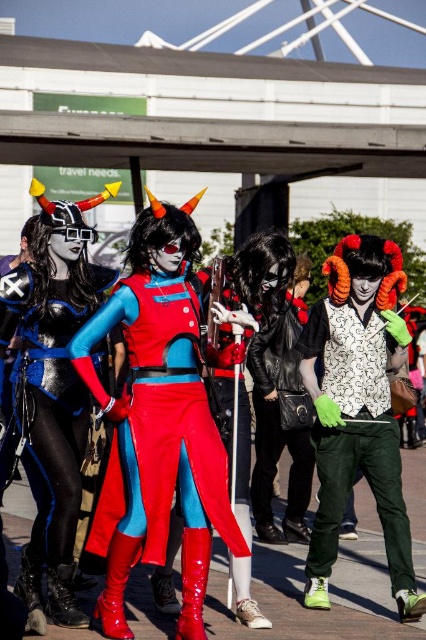
Question: Which point is closer to the camera?

Choices:
 (A) metallic blue bodysuit at center
 (B) matte black vest at center
 (C) shiny red boots at center

Answer: (A)

Question: Does shiny red boots at center have a smaller size compared to metallic blue bodysuit at center?

Choices:
 (A) no
 (B) yes

Answer: (A)

Question: Considering the relative positions of matte black vest at center and metallic blue bodysuit at center in the image provided, where is matte black vest at center located with respect to metallic blue bodysuit at center?

Choices:
 (A) right
 (B) left

Answer: (A)

Question: Estimate the real-world distances between objects in this image. Which object is farther from the matte black vest at center?

Choices:
 (A) shiny red boots at center
 (B) metallic blue bodysuit at center

Answer: (B)

Question: Does matte black vest at center have a lesser width compared to metallic blue bodysuit at center?

Choices:
 (A) yes
 (B) no

Answer: (B)

Question: Which point is closer to the camera?

Choices:
 (A) metallic blue bodysuit at center
 (B) shiny red boots at center
 (C) matte black vest at center

Answer: (A)